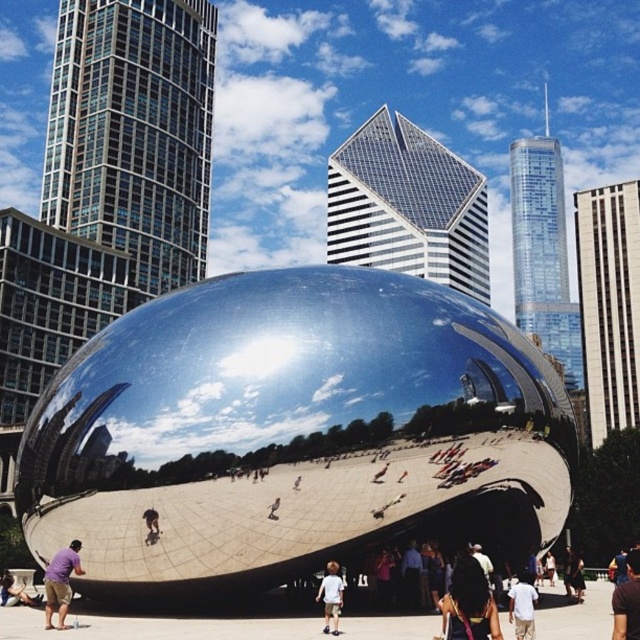
You are standing in front of the Cloud Gate sculpture in Chicago. You see a white cotton shirt at lower center. If you want to take a photo of the shirt while also capturing the reflection of the skyscrapers in the sculpture, where should you position yourself relative to the shirt?

The white cotton shirt at lower center is located at point (x=522, y=605). To capture both the shirt and the skyscraper reflections in the sculpture, position yourself to the left or right of the shirt, ensuring the shirt is within your camera frame while the sculpture reflects the skyscrapers behind you.

What are the coordinates of the dark brown hair at center?

The coordinates of the dark brown hair at center are (468,604).

You are a photographer standing in front of the Cloud Gate sculpture in Chicago. You notice a person with dark brown hair at center and a person wearing a brown fabric shirt at lower right. Which person is closer to you?

Result: The dark brown hair at center is closer to you because it is further to the viewer than the brown fabric shirt at lower right.